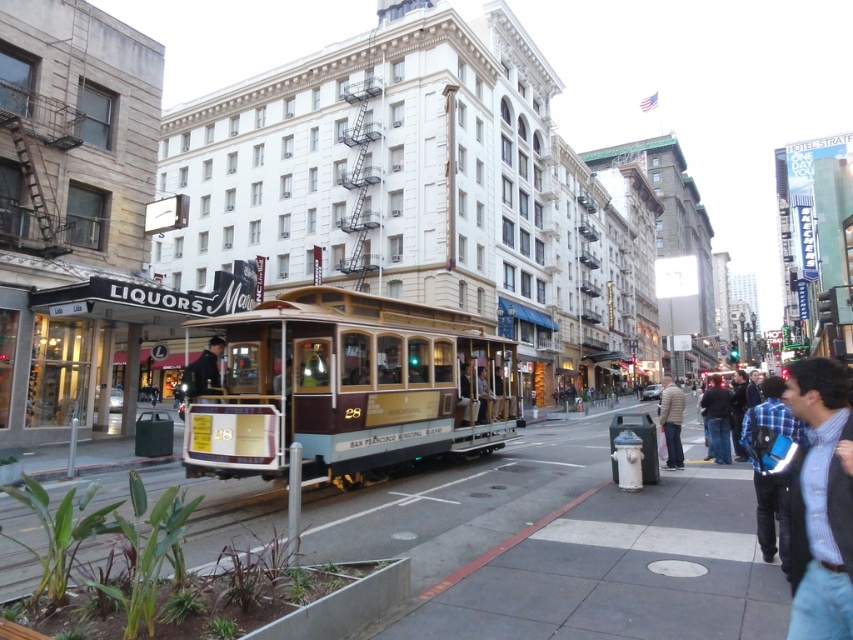
Question: Based on their relative distances, which object is nearer to the gold polished cable car at center?

Choices:
 (A) light brown leather jacket at center
 (B) dark blue jeans at lower right
 (C) dark blue jacket at center

Answer: (C)

Question: Is blue fabric backpack at lower right further to camera compared to light brown leather jacket at center?

Choices:
 (A) yes
 (B) no

Answer: (B)

Question: Which of the following is the farthest from the observer?

Choices:
 (A) blue striped shirt at center right
 (B) gold polished cable car at center
 (C) light brown leather jacket at center

Answer: (C)

Question: Which of the following is the farthest from the observer?

Choices:
 (A) (196, 374)
 (B) (231, 346)
 (C) (802, 584)

Answer: (B)

Question: Is gold polished cable car at center thinner than dark blue jacket at center?

Choices:
 (A) no
 (B) yes

Answer: (A)

Question: Is light brown leather jacket at center wider than dark blue jacket at center?

Choices:
 (A) yes
 (B) no

Answer: (A)